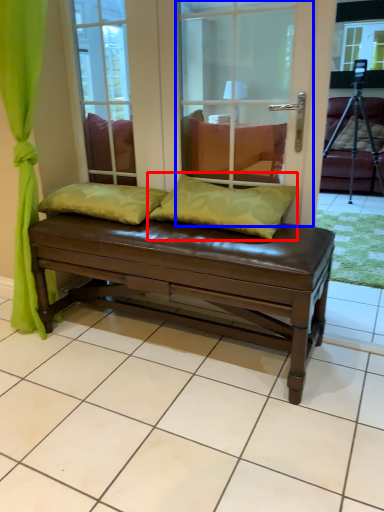
Question: Which of the following is the closest to the observer, pillow (highlighted by a red box) or screen door (highlighted by a blue box)?

Choices:
 (A) pillow
 (B) screen door

Answer: (B)